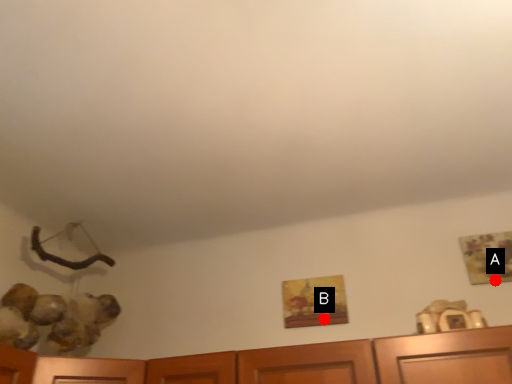
Question: Two points are circled on the image, labeled by A and B beside each circle. Among these points, which one is nearest to the camera?

Choices:
 (A) A is closer
 (B) B is closer

Answer: (A)